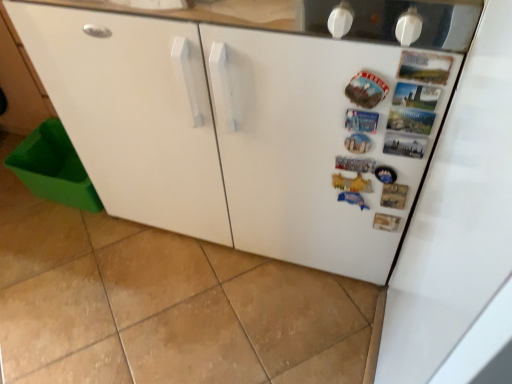
Question: Considering the positions of white matte refrigerator at center-right and green plastic bin at lower left in the image, is white matte refrigerator at center-right wider or thinner than green plastic bin at lower left?

Choices:
 (A) thin
 (B) wide

Answer: (A)

Question: In the image, is white matte refrigerator at center-right positioned in front of or behind green plastic bin at lower left?

Choices:
 (A) behind
 (B) front

Answer: (A)

Question: Based on their sizes in the image, would you say white matte refrigerator at center-right is bigger or smaller than green plastic bin at lower left?

Choices:
 (A) small
 (B) big

Answer: (A)

Question: In the image, is green plastic bin at lower left positioned in front of or behind white matte refrigerator at center-right?

Choices:
 (A) behind
 (B) front

Answer: (B)

Question: Based on their sizes in the image, would you say green plastic bin at lower left is bigger or smaller than white matte refrigerator at center-right?

Choices:
 (A) small
 (B) big

Answer: (B)

Question: Is green plastic bin at lower left situated inside white matte refrigerator at center-right or outside?

Choices:
 (A) inside
 (B) outside

Answer: (B)

Question: From the image's perspective, is green plastic bin at lower left above or below white matte refrigerator at center-right?

Choices:
 (A) below
 (B) above

Answer: (A)